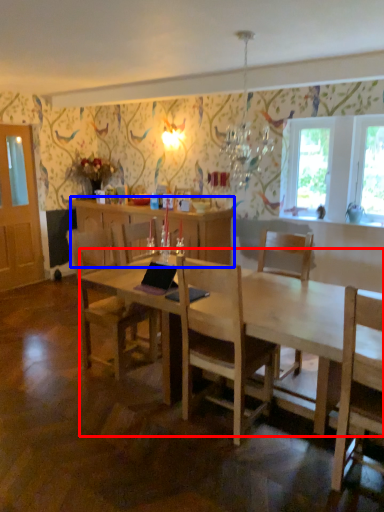
Question: Which object appears closest to the camera in this image, desk (highlighted by a red box) or cabinetry (highlighted by a blue box)?

Choices:
 (A) desk
 (B) cabinetry

Answer: (A)